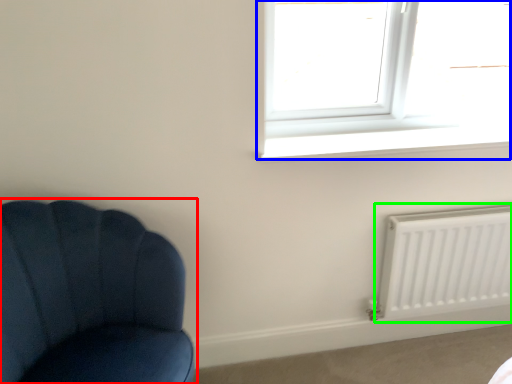
Question: Which object is the farthest from chair (highlighted by a red box)? Choose among these: window (highlighted by a blue box) or radiator (highlighted by a green box).

Choices:
 (A) window
 (B) radiator

Answer: (B)